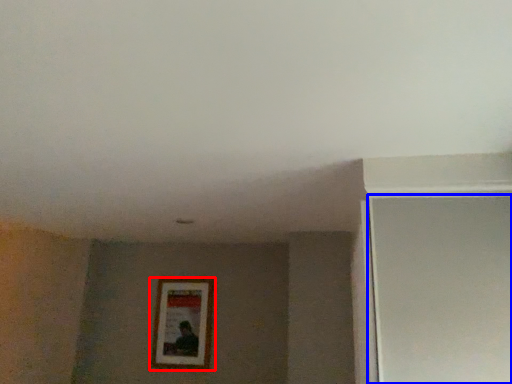
Question: Which point is closer to the camera, picture frame (highlighted by a red box) or screen door (highlighted by a blue box)?

Choices:
 (A) picture frame
 (B) screen door

Answer: (B)